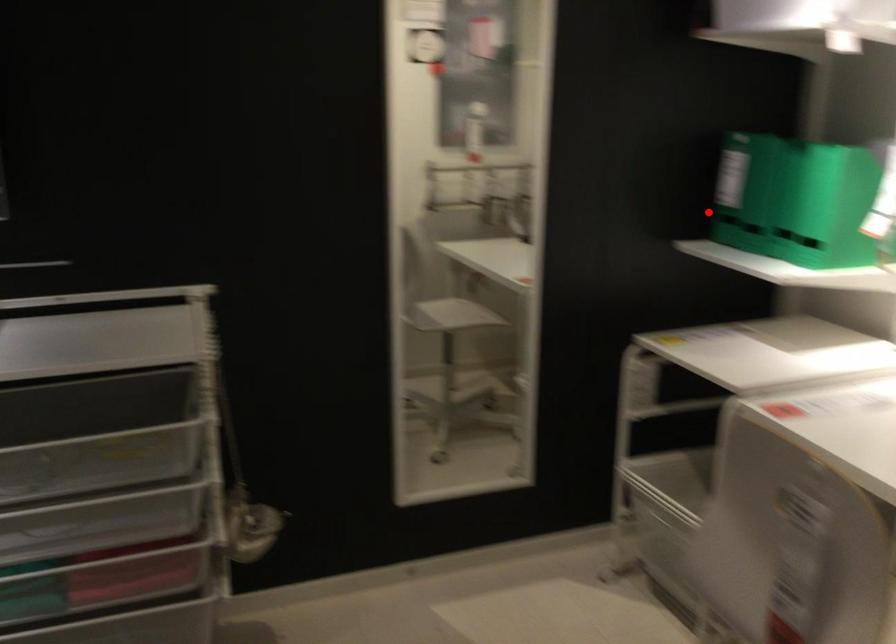
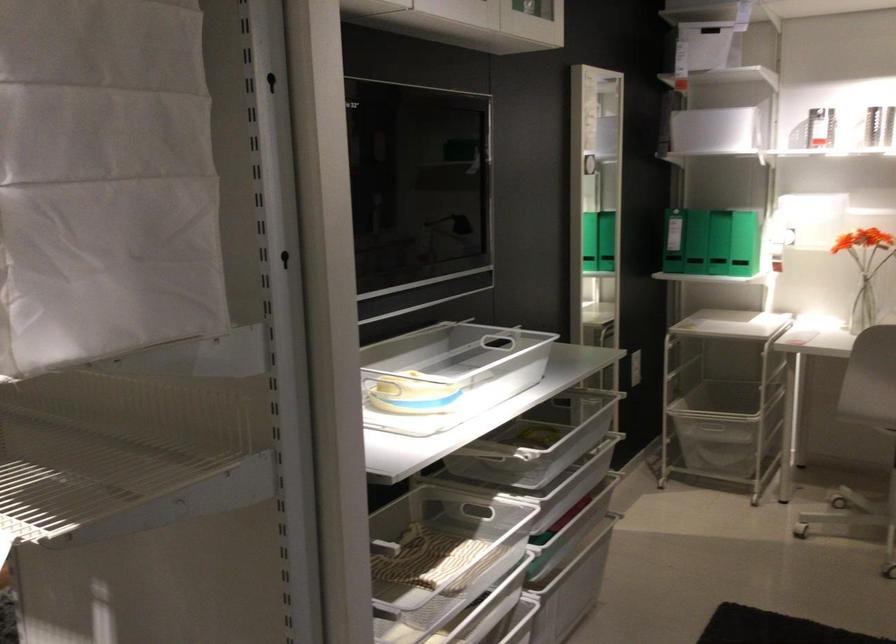
The point at the highlighted location is marked in the first image. Where is the corresponding point in the second image?

(695, 242)